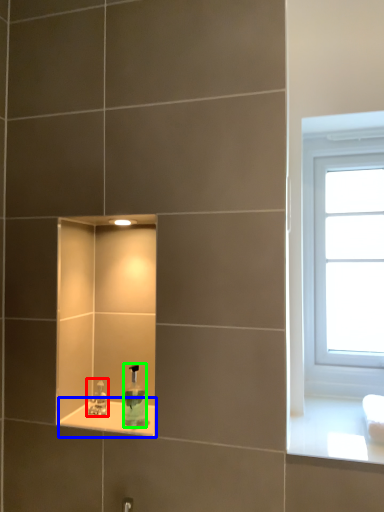
Question: Estimate the real-world distances between objects in this image. Which object is farther from tap (highlighted by a red box), window sill (highlighted by a blue box) or soap dispenser (highlighted by a green box)?

Choices:
 (A) window sill
 (B) soap dispenser

Answer: (B)